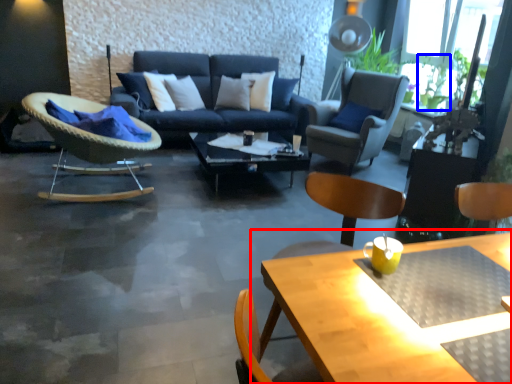
Question: Which point is closer to the camera, table (highlighted by a red box) or plant (highlighted by a blue box)?

Choices:
 (A) table
 (B) plant

Answer: (A)